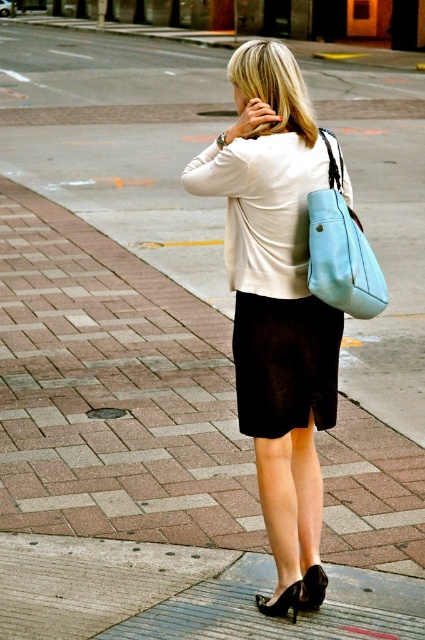
You are standing on the sidewalk and want to walk towards the street. You notice two points marked on the ground. The first point is at coordinate point (305, 218) and the second at point (360, 241). Which point is closer to you as you face the street?

Point (305, 218) is further to the camera than point (360, 241). Therefore, point (360, 241) is closer to you as you face the street.